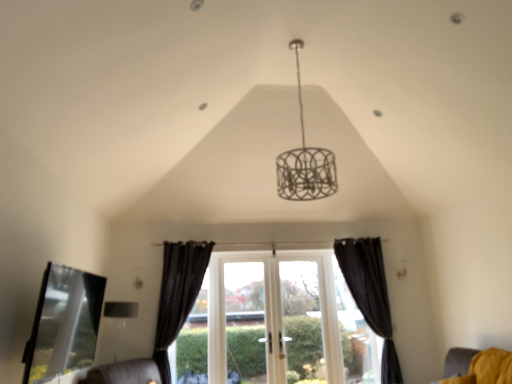
Question: Can we say white wood window at center lies outside matte silver lampshade at lower left?

Choices:
 (A) yes
 (B) no

Answer: (A)

Question: From the image's perspective, is white wood window at center beneath matte silver lampshade at lower left?

Choices:
 (A) yes
 (B) no

Answer: (A)

Question: Does white wood window at center appear on the right side of matte silver lampshade at lower left?

Choices:
 (A) no
 (B) yes

Answer: (B)

Question: Is white wood window at center aimed at matte silver lampshade at lower left?

Choices:
 (A) no
 (B) yes

Answer: (A)

Question: Considering the relative positions of white wood window at center and matte silver lampshade at lower left in the image provided, is white wood window at center in front of matte silver lampshade at lower left?

Choices:
 (A) yes
 (B) no

Answer: (B)

Question: From the image's perspective, is white wood window at center on top of matte silver lampshade at lower left?

Choices:
 (A) no
 (B) yes

Answer: (A)

Question: Considering the relative sizes of matte silver lampshade at lower left and yellow fabric cushion at lower right in the image provided, is matte silver lampshade at lower left taller than yellow fabric cushion at lower right?

Choices:
 (A) no
 (B) yes

Answer: (B)

Question: Would you say yellow fabric cushion at lower right is part of matte silver lampshade at lower left's contents?

Choices:
 (A) yes
 (B) no

Answer: (B)

Question: From a real-world perspective, is matte silver lampshade at lower left over yellow fabric cushion at lower right?

Choices:
 (A) no
 (B) yes

Answer: (B)

Question: From the image's perspective, would you say matte silver lampshade at lower left is shown under yellow fabric cushion at lower right?

Choices:
 (A) yes
 (B) no

Answer: (A)

Question: Does matte silver lampshade at lower left have a lesser height compared to yellow fabric cushion at lower right?

Choices:
 (A) yes
 (B) no

Answer: (B)

Question: Considering the relative sizes of matte silver lampshade at lower left and yellow fabric cushion at lower right in the image provided, is matte silver lampshade at lower left smaller than yellow fabric cushion at lower right?

Choices:
 (A) no
 (B) yes

Answer: (A)

Question: Considering the relative sizes of white wood window at center and transparent glass bay window at lower left in the image provided, is white wood window at center wider than transparent glass bay window at lower left?

Choices:
 (A) yes
 (B) no

Answer: (B)